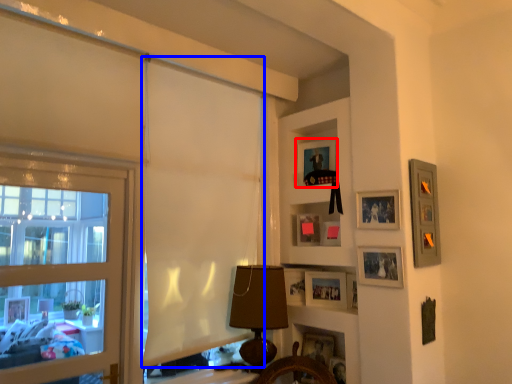
Question: Which of the following is the closest to the observer, picture frame (highlighted by a red box) or curtain (highlighted by a blue box)?

Choices:
 (A) picture frame
 (B) curtain

Answer: (B)